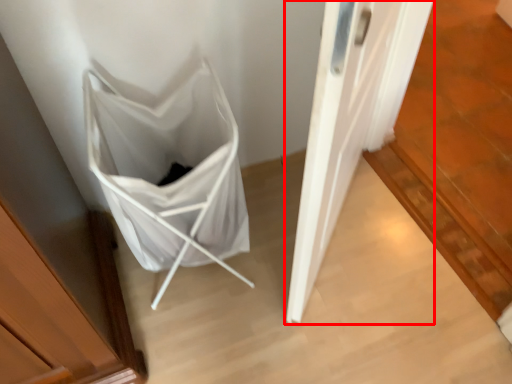
Question: From the image's perspective, where is door (annotated by the red box) located relative to folding chair?

Choices:
 (A) above
 (B) below

Answer: (A)